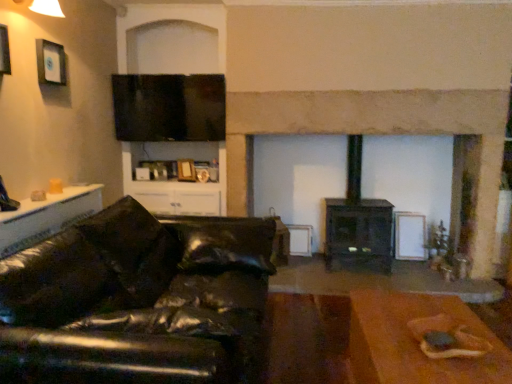
Question: Is black leather couch at left at the back of flat matte screen at upper center?

Choices:
 (A) no
 (B) yes

Answer: (A)

Question: Does flat matte screen at upper center touch black leather couch at left?

Choices:
 (A) yes
 (B) no

Answer: (B)

Question: Is flat matte screen at upper center wider than black leather couch at left?

Choices:
 (A) no
 (B) yes

Answer: (A)

Question: Does flat matte screen at upper center have a lesser width compared to black leather couch at left?

Choices:
 (A) no
 (B) yes

Answer: (B)

Question: Is flat matte screen at upper center not close to black leather couch at left?

Choices:
 (A) yes
 (B) no

Answer: (A)

Question: Is flat matte screen at upper center in front of or behind black matte wood burning stove at center in the image?

Choices:
 (A) front
 (B) behind

Answer: (B)

Question: Is flat matte screen at upper center bigger or smaller than black matte wood burning stove at center?

Choices:
 (A) small
 (B) big

Answer: (A)

Question: From a real-world perspective, is flat matte screen at upper center physically located above or below black matte wood burning stove at center?

Choices:
 (A) below
 (B) above

Answer: (B)

Question: Do you think flat matte screen at upper center is within black matte wood burning stove at center, or outside of it?

Choices:
 (A) outside
 (B) inside

Answer: (A)

Question: In terms of size, does black matte wood burning stove at center appear bigger or smaller than white glossy table at left, which is the second table from right to left?

Choices:
 (A) big
 (B) small

Answer: (A)

Question: From the image's perspective, is black matte wood burning stove at center above or below white glossy table at left, positioned as the 2th table in bottom-to-top order?

Choices:
 (A) above
 (B) below

Answer: (B)

Question: Does point (357, 188) appear closer or farther from the camera than point (52, 210)?

Choices:
 (A) closer
 (B) farther

Answer: (B)

Question: Based on their positions, is black matte wood burning stove at center located to the left or right of white glossy table at left, the first table when ordered from top to bottom?

Choices:
 (A) left
 (B) right

Answer: (B)

Question: In terms of height, does brown wooden table at lower right, arranged as the first table when viewed from the right, look taller or shorter compared to black leather couch at left?

Choices:
 (A) tall
 (B) short

Answer: (B)

Question: Considering the positions of point (353, 365) and point (128, 216), is point (353, 365) closer or farther from the camera than point (128, 216)?

Choices:
 (A) farther
 (B) closer

Answer: (B)